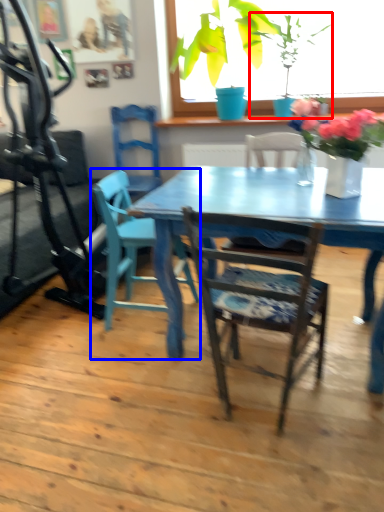
Question: Which object appears farthest to the camera in this image, houseplant (highlighted by a red box) or chair (highlighted by a blue box)?

Choices:
 (A) houseplant
 (B) chair

Answer: (A)